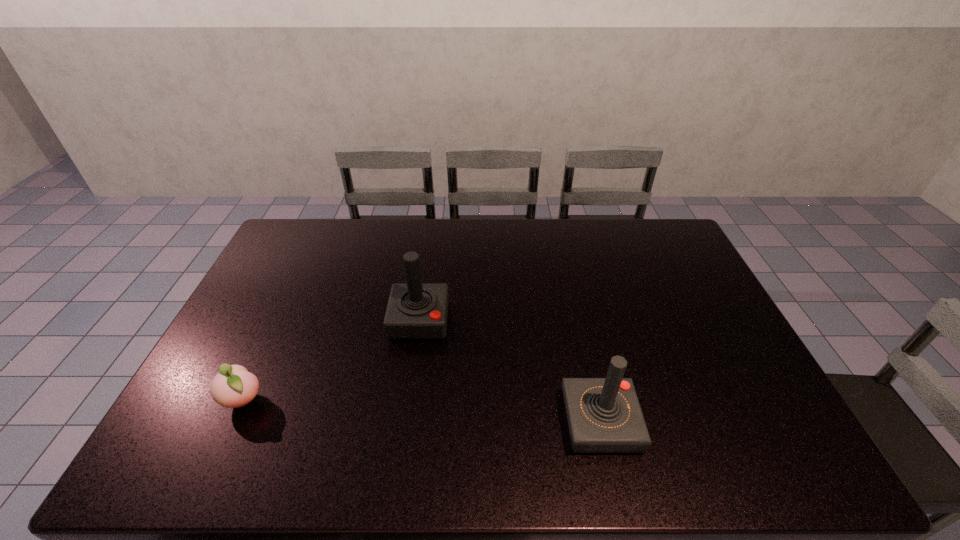
The width and height of the screenshot is (960, 540). Find the location of `object that stands as the second closest to the peach`. object that stands as the second closest to the peach is located at coordinates (604, 415).